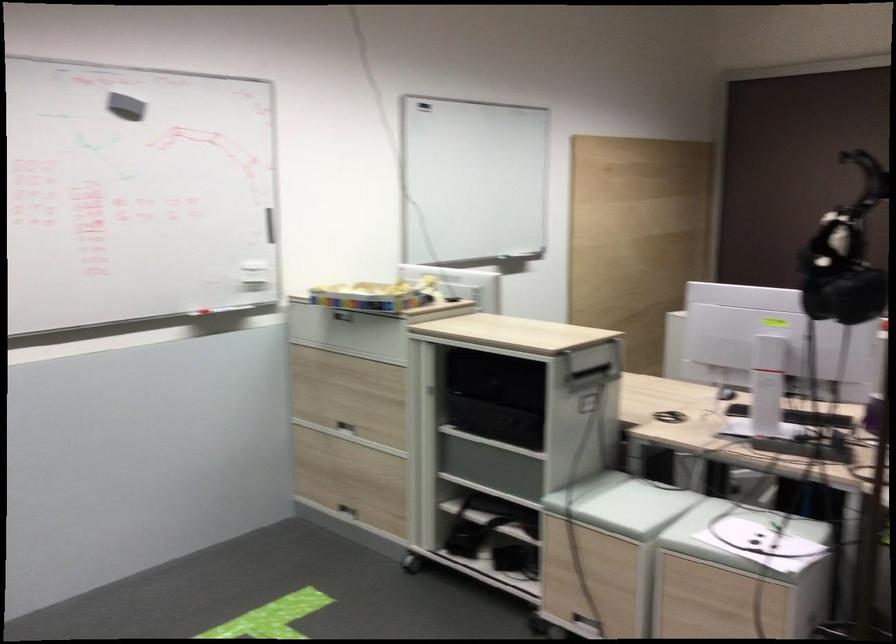
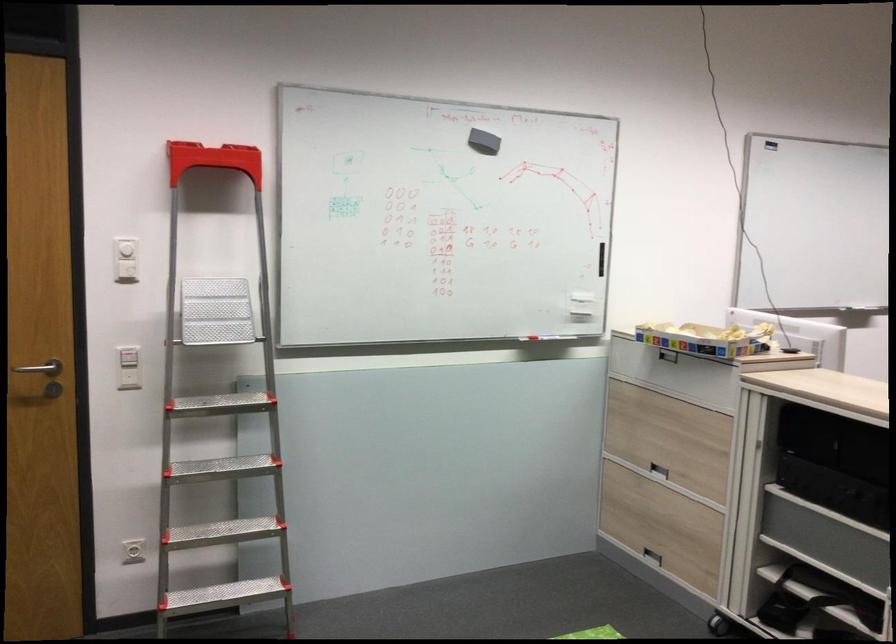
Where in the second image is the point corresponding to point 348,507 from the first image?

(652, 556)